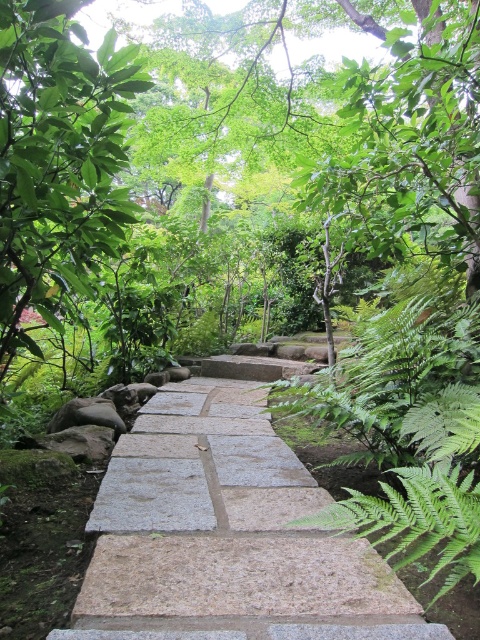
Is gray stone path at center below green leafy tree at upper left?

Indeed, gray stone path at center is positioned under green leafy tree at upper left.

Who is higher up, gray stone path at center or green leafy tree at upper left?

Positioned higher is green leafy tree at upper left.

Is point (235, 609) farther from viewer compared to point (9, 356)?

No, it is in front of (9, 356).

Locate an element on the screen. Image resolution: width=480 pixels, height=640 pixels. gray stone path at center is located at coordinates (226, 532).